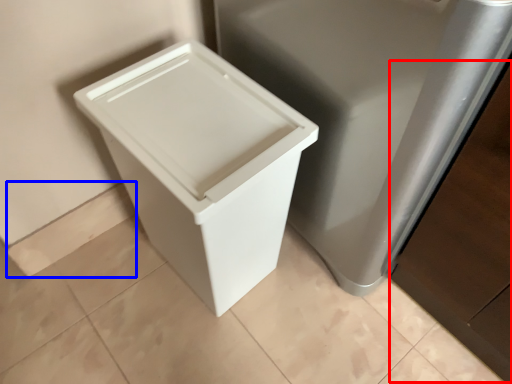
Question: Which object is further to the camera taking this photo, cabinetry (highlighted by a red box) or square (highlighted by a blue box)?

Choices:
 (A) cabinetry
 (B) square

Answer: (B)